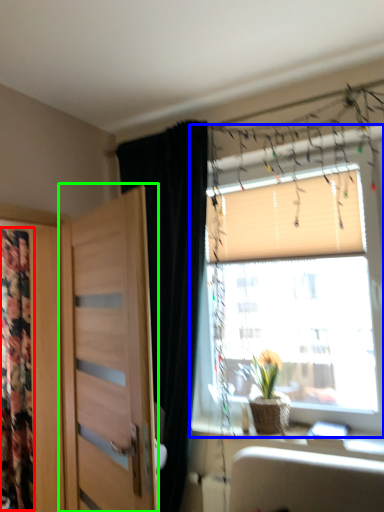
Question: Based on their relative distances, which object is farther from tapestry (highlighted by a red box)? Choose from window (highlighted by a blue box) and door (highlighted by a green box).

Choices:
 (A) window
 (B) door

Answer: (A)